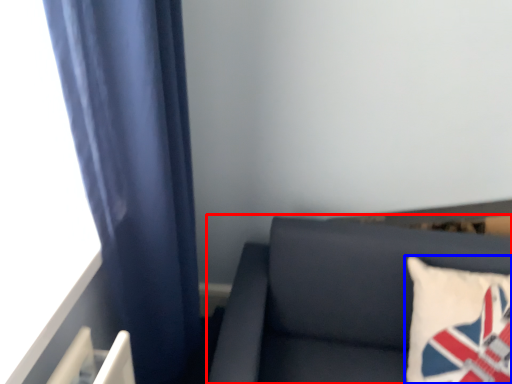
Question: Which of the following is the farthest to the observer, furniture (highlighted by a red box) or pillow (highlighted by a blue box)?

Choices:
 (A) furniture
 (B) pillow

Answer: (B)